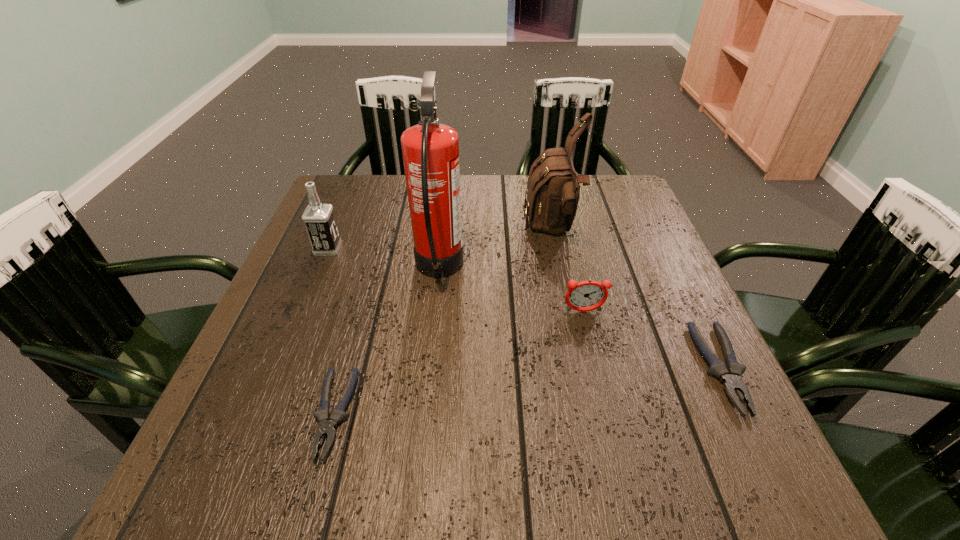
Where is `vacant position for inserting another pliers evenly`? Image resolution: width=960 pixels, height=540 pixels. vacant position for inserting another pliers evenly is located at coordinates [536, 390].